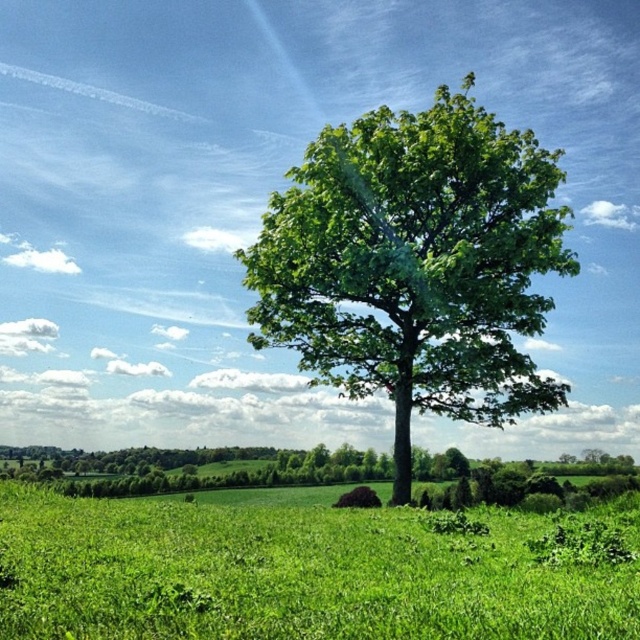
You are a gardener who wants to plant a new tree in the green grassy field at center. Considering the existing green leafy tree at center, which one is taller so that it might cast more shade over the field?

The green leafy tree at center is taller than the green grassy field at center, so it might cast more shade over the field.

You are standing at the point marked as point [305,572]. Looking around, what do you see in the immediate vicinity?

At point [305,572], you see the green grassy field at center in the immediate vicinity.

You are a hiker who needs to place a 5 meter long tent between the green grassy field at center and the green leafy tree at center. Can you fit the tent horizontally between them without touching either?

The distance between the green grassy field at center and the green leafy tree at center is 6.03 meters. Since the tent is 5 meters long, it can be placed horizontally between them with 0.515 meters of space on each side, so yes, it will fit without touching either.